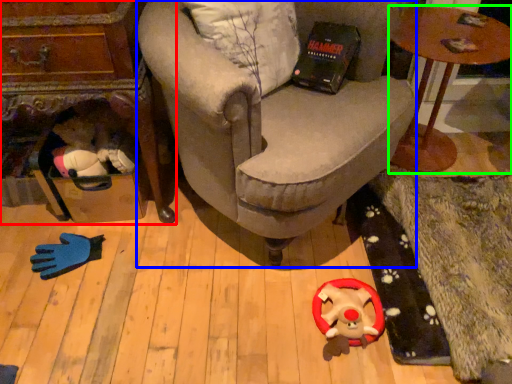
Question: Considering the real-world distances, which object is closest to table (highlighted by a red box)? chair (highlighted by a blue box) or table (highlighted by a green box).

Choices:
 (A) chair
 (B) table

Answer: (A)